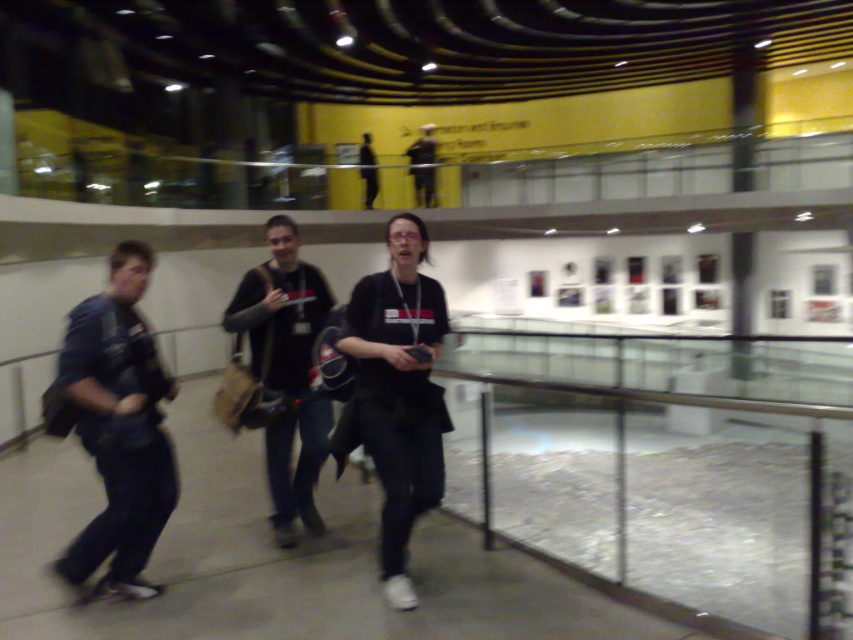
Question: Which object appears farthest from the camera in this image?

Choices:
 (A) dark blue jeans at center
 (B) dark gray fabric jacket at center
 (C) dark blue fabric jacket at left
 (D) black matte shirt at center

Answer: (B)

Question: Is dark blue fabric jacket at left wider than dark gray fabric jacket at center?

Choices:
 (A) yes
 (B) no

Answer: (A)

Question: Among these points, which one is nearest to the camera?

Choices:
 (A) (252, 321)
 (B) (393, 477)
 (C) (120, 262)

Answer: (B)

Question: Which object is the closest to the dark gray fabric jacket at center?

Choices:
 (A) black matte shirt at center
 (B) dark blue jeans at center

Answer: (B)

Question: Does dark blue fabric jacket at left have a smaller size compared to dark gray fabric jacket at center?

Choices:
 (A) no
 (B) yes

Answer: (B)

Question: Does dark blue fabric jacket at left appear on the right side of dark gray fabric jacket at center?

Choices:
 (A) no
 (B) yes

Answer: (A)